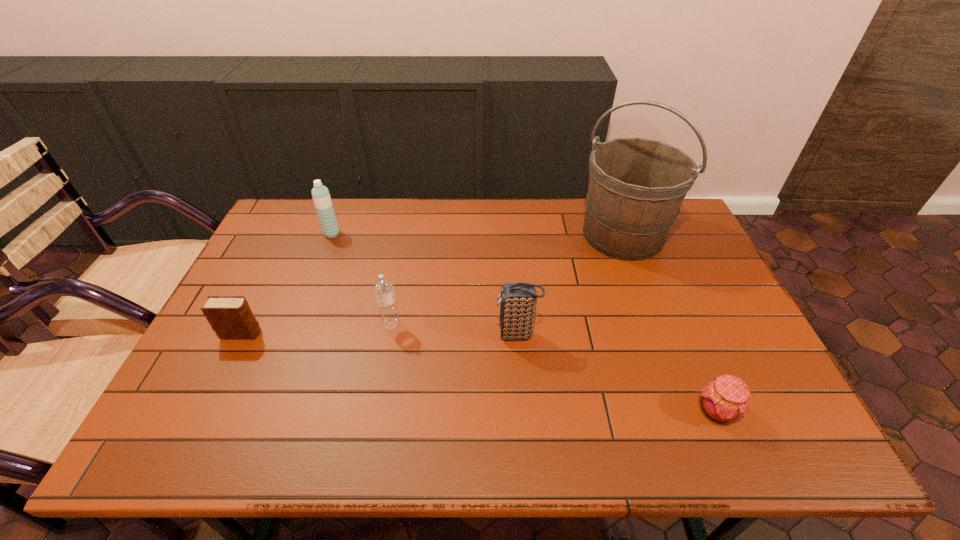
At what (x,y) coordinates should I click in order to perform the action: click on object situated at the near edge. Please return your answer as a coordinate pair (x, y). The height and width of the screenshot is (540, 960). Looking at the image, I should click on (723, 400).

The image size is (960, 540). Find the location of `object that is at the left edge`. object that is at the left edge is located at coordinates (231, 317).

Where is `bucket located in the right edge section of the desktop`? The image size is (960, 540). bucket located in the right edge section of the desktop is located at coordinates (636, 187).

Identify the location of jam present at the right edge. (723, 400).

Locate an element on the screen. The width and height of the screenshot is (960, 540). object that is at the far right corner is located at coordinates (636, 187).

Identify the location of object that is at the near right corner. (723, 400).

Find the location of a particular element. free space at the far edge of the desktop is located at coordinates (446, 232).

The image size is (960, 540). In order to click on free region at the near edge in this screenshot , I will do `click(616, 439)`.

This screenshot has height=540, width=960. What are the coordinates of `vacant space at the left edge` in the screenshot? It's located at (226, 361).

The height and width of the screenshot is (540, 960). What are the coordinates of `free location at the right edge of the desktop` in the screenshot? It's located at (701, 251).